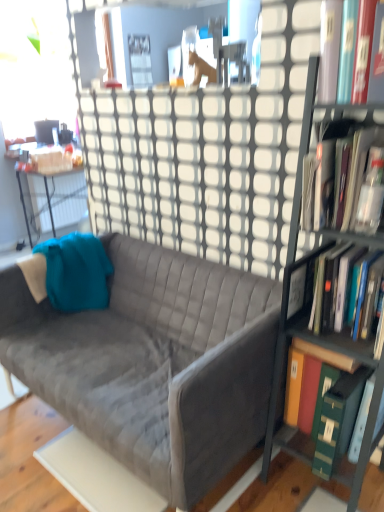
In order to face hardcover book at right, acting as the third book starting from the bottom, should I rotate leftwards or rightwards?

Rotate right and turn 21.740 degrees.

What do you see at coordinates (333, 288) in the screenshot? Image resolution: width=384 pixels, height=512 pixels. I see `hardcover book at right, acting as the third book starting from the top` at bounding box center [333, 288].

What do you see at coordinates (314, 383) in the screenshot? I see `green hardcover book at right, marked as the 4th book in a top-to-bottom arrangement` at bounding box center [314, 383].

I want to click on matte black desk at left, so click(x=10, y=204).

Which is in front, point (358, 378) or point (355, 205)?

The point (355, 205) is in front.

Is green hardcover book at right, marked as the 4th book in a top-to-bottom arrangement, smaller than hardcover book at right, marked as the 2th book in a top-to-bottom arrangement?

No, green hardcover book at right, marked as the 4th book in a top-to-bottom arrangement, is not smaller than hardcover book at right, marked as the 2th book in a top-to-bottom arrangement.

Choose the correct answer: Is green hardcover book at right, marked as the 4th book in a top-to-bottom arrangement, inside hardcover book at right, acting as the third book starting from the bottom, or outside it?

green hardcover book at right, marked as the 4th book in a top-to-bottom arrangement, is located beyond the bounds of hardcover book at right, acting as the third book starting from the bottom.

Looking at this image, from the image's perspective, which is above, green hardcover book at right, marked as the 4th book in a top-to-bottom arrangement, or hardcover book at right, acting as the third book starting from the bottom?

hardcover book at right, acting as the third book starting from the bottom, appears higher in the image.

Is hardcover book at upper right, which is the 4th book from bottom to top, taller or shorter than matte black desk at left?

hardcover book at upper right, which is the 4th book from bottom to top, is shorter than matte black desk at left.

Is point (340, 73) closer or farther from the camera than point (13, 194)?

Point (340, 73) is closer to the camera than point (13, 194).

Can you tell me how much hardcover book at upper right, which is counted as the first book, starting from the top, and matte black desk at left differ in facing direction?

hardcover book at upper right, which is counted as the first book, starting from the top, and matte black desk at left are facing 91 degrees away from each other.

From the image's perspective, is hardcover book at upper right, which is counted as the first book, starting from the top, located beneath matte black desk at left?

Actually, hardcover book at upper right, which is counted as the first book, starting from the top, appears above matte black desk at left in the image.

Is hardcover book at upper right, which is counted as the first book, starting from the top, at the left side of hardcover book at right, marked as the 2th book in a top-to-bottom arrangement?

Indeed, hardcover book at upper right, which is counted as the first book, starting from the top, is positioned on the left side of hardcover book at right, marked as the 2th book in a top-to-bottom arrangement.

Which is more distant, (364, 100) or (305, 181)?

Point (305, 181)

Does hardcover book at upper right, which is the 4th book from bottom to top, turn towards hardcover book at right, acting as the third book starting from the bottom?

No, hardcover book at upper right, which is the 4th book from bottom to top, is not facing towards hardcover book at right, acting as the third book starting from the bottom.

From the image's perspective, between teal fabric throw pillow at left and hardcover book at right, acting as the third book starting from the bottom, which one is located above?

hardcover book at right, acting as the third book starting from the bottom, appears higher in the image.

Considering the sizes of objects teal fabric throw pillow at left and hardcover book at right, marked as the 2th book in a top-to-bottom arrangement, in the image provided, who is taller, teal fabric throw pillow at left or hardcover book at right, marked as the 2th book in a top-to-bottom arrangement,?

With more height is teal fabric throw pillow at left.

Which object is wider, teal fabric throw pillow at left or hardcover book at right, acting as the third book starting from the bottom?

hardcover book at right, acting as the third book starting from the bottom, is wider.

Measure the distance from teal fabric throw pillow at left to hardcover book at right, acting as the third book starting from the bottom.

They are 1.30 meters apart.

Is hardcover book at upper right, which is the 4th book from bottom to top, taller than green hardcover book at right, marked as the 4th book in a top-to-bottom arrangement?

No.

Would you say hardcover book at upper right, which is the 4th book from bottom to top, is to the left or to the right of green hardcover book at right, marked as the 4th book in a top-to-bottom arrangement, in the picture?

From the image, it's evident that hardcover book at upper right, which is the 4th book from bottom to top, is to the left of green hardcover book at right, marked as the 4th book in a top-to-bottom arrangement.

Who is bigger, hardcover book at upper right, which is the 4th book from bottom to top, or green hardcover book at right, which ranks as the first book in bottom-to-top order?

Bigger between the two is green hardcover book at right, which ranks as the first book in bottom-to-top order.

Starting from the hardcover book at upper right, which is the 4th book from bottom to top, which book is the 3rd one behind? Please provide its 2D coordinates.

[(314, 383)]

Consider the image. Is hardcover book at upper right, which is counted as the first book, starting from the top, not inside teal fabric throw pillow at left?

hardcover book at upper right, which is counted as the first book, starting from the top, is positioned outside teal fabric throw pillow at left.

From the image's perspective, does hardcover book at upper right, which is the 4th book from bottom to top, appear lower than teal fabric throw pillow at left?

Incorrect, from the image's perspective, hardcover book at upper right, which is the 4th book from bottom to top, is higher than teal fabric throw pillow at left.

Based on their sizes in the image, would you say metallic gray bookcase at right is bigger or smaller than teal fabric throw pillow at left?

Considering their sizes, metallic gray bookcase at right takes up more space than teal fabric throw pillow at left.

Measure the distance from metallic gray bookcase at right to teal fabric throw pillow at left.

metallic gray bookcase at right and teal fabric throw pillow at left are 3.66 feet apart.

Which of these two, metallic gray bookcase at right or teal fabric throw pillow at left, stands taller?

With more height is metallic gray bookcase at right.

Which book is the 2nd one when counting from the back of the hardcover book at right, acting as the third book starting from the bottom? Please provide its 2D coordinates.

[(314, 383)]

Locate an element on the screen. Image resolution: width=384 pixels, height=512 pixels. desk below the hardcover book at upper right, which is the 4th book from bottom to top (from a real-world perspective) is located at coordinates (10, 204).

Looking at this image, based on their spatial positions, is velvet gray couch at center or hardcover book at right, marked as the 2th book in a top-to-bottom arrangement, closer to metallic gray bookcase at right?

hardcover book at right, marked as the 2th book in a top-to-bottom arrangement, is closer to metallic gray bookcase at right.

Considering their positions, is velvet gray couch at center positioned closer to hardcover book at upper right, which is counted as the first book, starting from the top, than hardcover book at right, marked as the 2th book in a top-to-bottom arrangement?

hardcover book at right, marked as the 2th book in a top-to-bottom arrangement, lies closer to hardcover book at upper right, which is counted as the first book, starting from the top, than the other object.

Estimate the real-world distances between objects in this image. Which object is closer to hardcover book at upper right, which is the 4th book from bottom to top, matte black desk at left or hardcover book at right, acting as the third book starting from the top?

The object closer to hardcover book at upper right, which is the 4th book from bottom to top, is hardcover book at right, acting as the third book starting from the top.

Looking at the image, which one is located further to hardcover book at upper right, which is counted as the first book, starting from the top, metallic gray bookcase at right or velvet gray couch at center?

Among the two, velvet gray couch at center is located further to hardcover book at upper right, which is counted as the first book, starting from the top.

From the image, which object appears to be nearer to hardcover book at upper right, which is counted as the first book, starting from the top, hardcover book at right, marked as the 2th book in a top-to-bottom arrangement, or green hardcover book at right, which ranks as the first book in bottom-to-top order?

hardcover book at right, marked as the 2th book in a top-to-bottom arrangement, is positioned closer to the anchor hardcover book at upper right, which is counted as the first book, starting from the top.

Looking at the image, which one is located closer to hardcover book at upper right, which is the 4th book from bottom to top, hardcover book at right, marked as the 2th book in a top-to-bottom arrangement, or velvet gray couch at center?

hardcover book at right, marked as the 2th book in a top-to-bottom arrangement, is positioned closer to the anchor hardcover book at upper right, which is the 4th book from bottom to top.

Which object lies further to the anchor point hardcover book at upper right, which is the 4th book from bottom to top, velvet gray couch at center or teal fabric throw pillow at left?

teal fabric throw pillow at left lies further to hardcover book at upper right, which is the 4th book from bottom to top, than the other object.

Considering their positions, is velvet gray couch at center positioned further to hardcover book at right, marked as the 2th book in a top-to-bottom arrangement, than matte black desk at left?

matte black desk at left.

Locate an element on the screen. bookcase between hardcover book at right, acting as the third book starting from the bottom, and green hardcover book at right, marked as the 4th book in a top-to-bottom arrangement, in the up-down direction is located at coordinates (307, 276).

The image size is (384, 512). I want to click on throw pillow positioned between metallic gray bookcase at right and matte black desk at left from near to far, so click(76, 272).

Where is `bookcase between hardcover book at upper right, which is counted as the first book, starting from the top, and green hardcover book at right, which ranks as the first book in bottom-to-top order, vertically`? The width and height of the screenshot is (384, 512). bookcase between hardcover book at upper right, which is counted as the first book, starting from the top, and green hardcover book at right, which ranks as the first book in bottom-to-top order, vertically is located at coordinates (307, 276).

Identify the location of bookcase between hardcover book at right, acting as the third book starting from the top, and green hardcover book at right, marked as the 4th book in a top-to-bottom arrangement, in the vertical direction. The width and height of the screenshot is (384, 512). (307, 276).